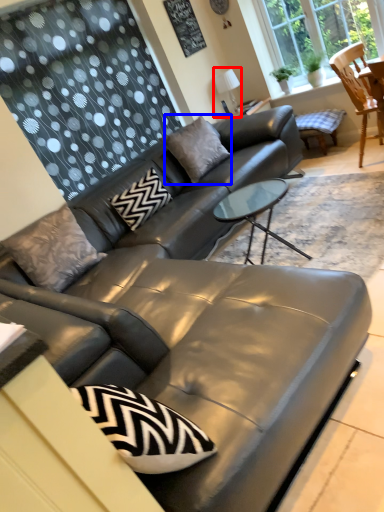
Question: Which object is further to the camera taking this photo, lamp (highlighted by a red box) or pillow (highlighted by a blue box)?

Choices:
 (A) lamp
 (B) pillow

Answer: (A)